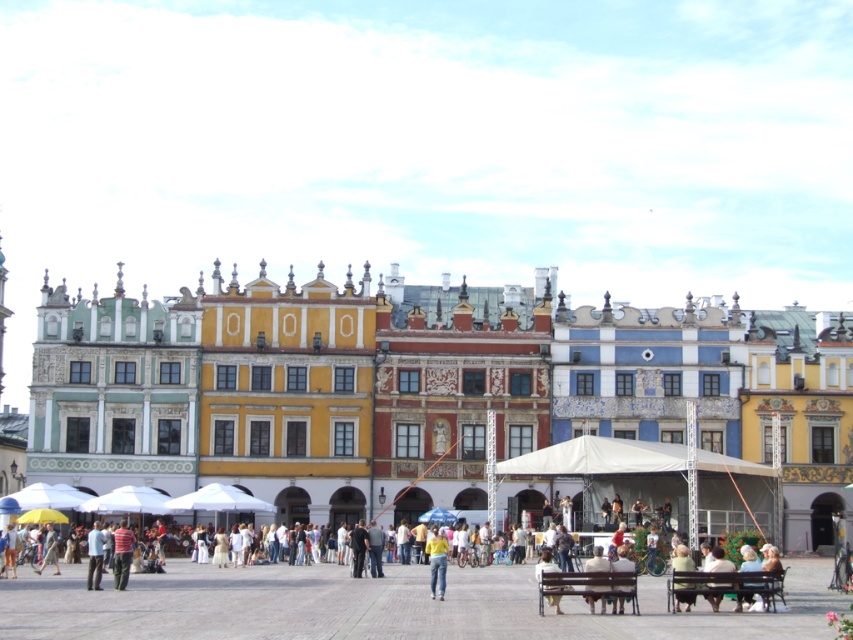
You are a photographer standing in the urban square. You want to capture a photo that includes both the yellow matte shirt at center and the light blue fabric jacket at lower left. Which of the two clothing items appears narrower in the photo?

The yellow matte shirt at center appears narrower in the photo compared to the light blue fabric jacket at lower left because it has a lesser width.

In the scene shown: You are a photographer standing in the urban square. You want to take a photo that includes both the white cotton shirt at lower center and the yellow matte shirt at center. Which shirt should you focus on first to ensure both are in the frame?

The white cotton shirt at lower center is taller than the yellow matte shirt at center, so focusing on the taller shirt first will help ensure both are in the frame.

You are a photographer trying to capture a photo of the yellow matte shirt at center and the light blue fabric jacket at lower left in the same frame. Based on their sizes in the image, which one would require you to zoom in more to ensure it is clearly visible?

The yellow matte shirt at center occupies less space than the light blue fabric jacket at lower left, so to ensure it is clearly visible, you would need to zoom in more on the yellow matte shirt at center.